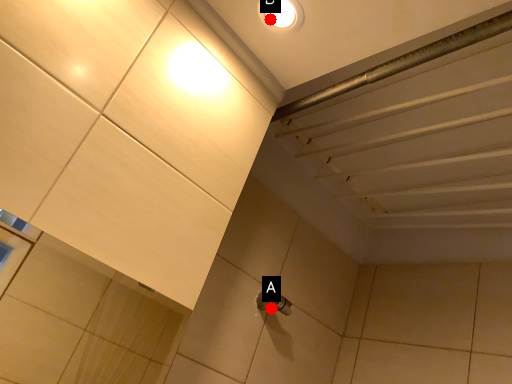
Question: Two points are circled on the image, labeled by A and B beside each circle. Which of the following is the farthest from the observer?

Choices:
 (A) A is further
 (B) B is further

Answer: (A)